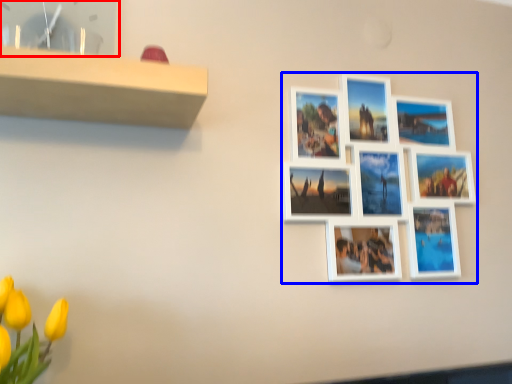
Question: Among these objects, which one is nearest to the camera, picture frame (highlighted by a red box) or picture frame (highlighted by a blue box)?

Choices:
 (A) picture frame
 (B) picture frame

Answer: (A)